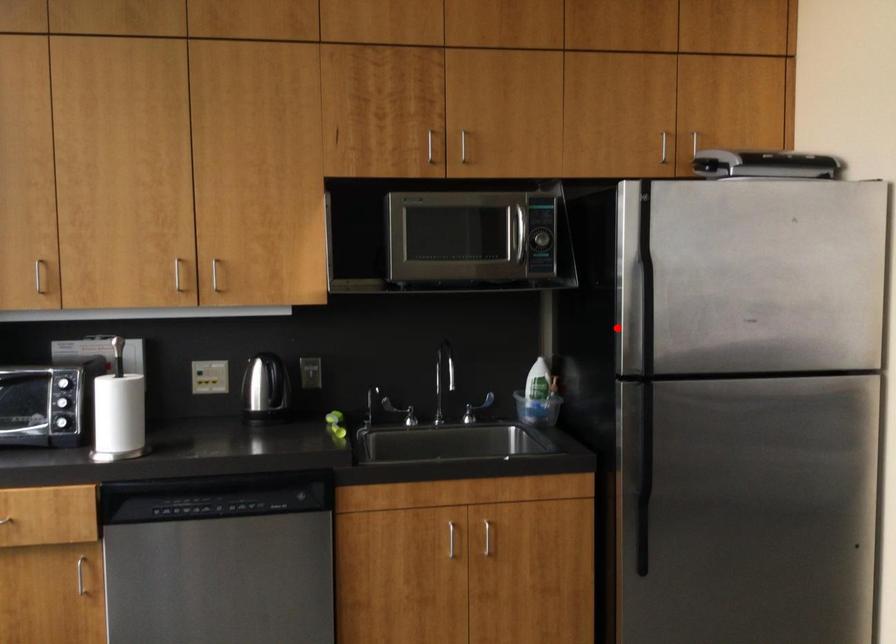
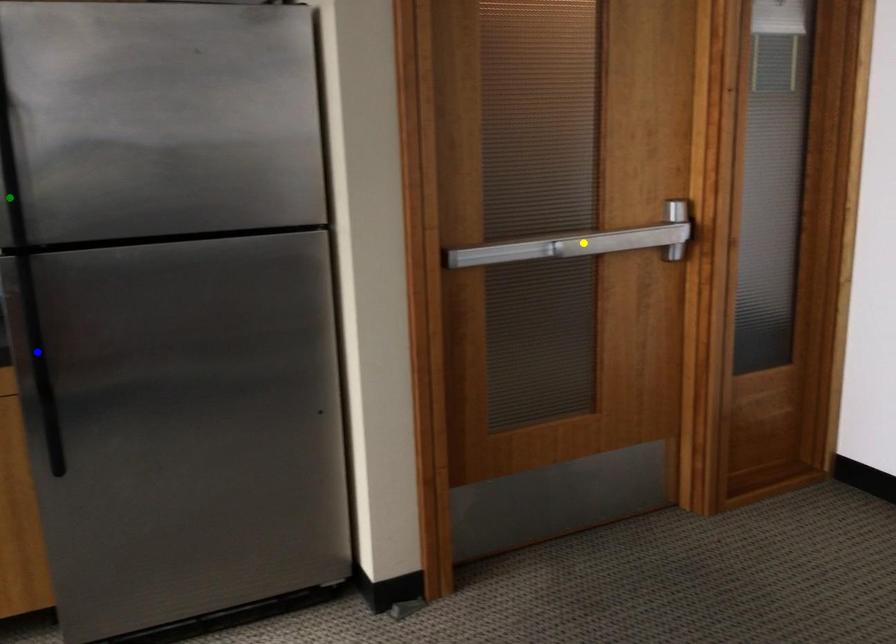
Question: I am providing you with two images of the same scene from different viewpoints. A red point is marked on the first image. You are given multiple points on the second image. Which spot in image 2 lines up with the point in image 1?

Choices:
 (A) yellow point
 (B) green point
 (C) blue point

Answer: (B)